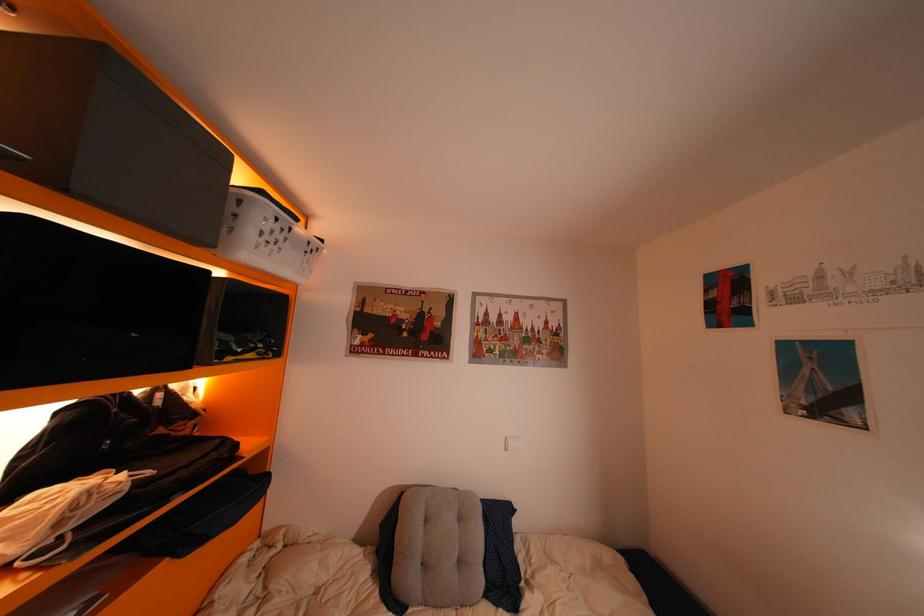
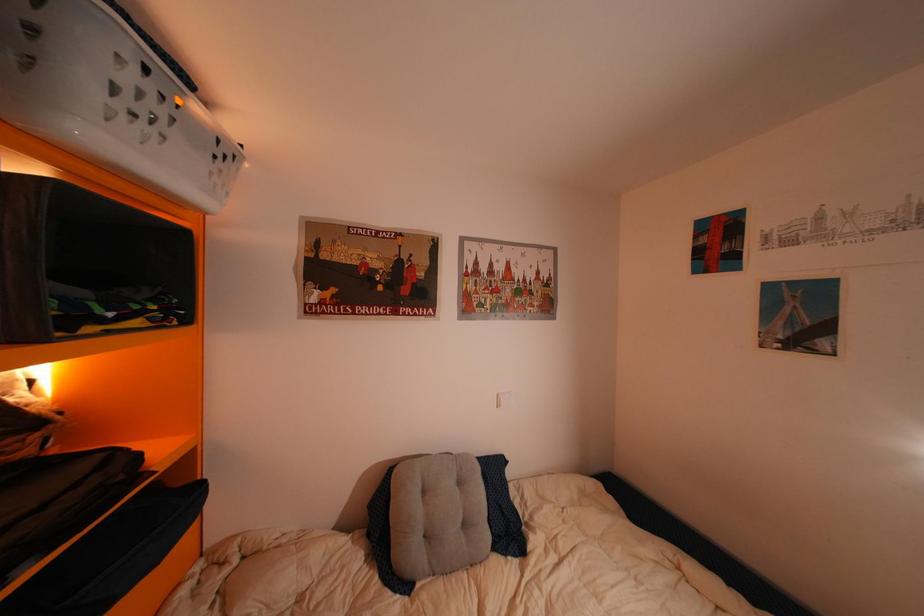
What movement of the cameraman would produce the second image?

The cameraman moved toward left, forward.